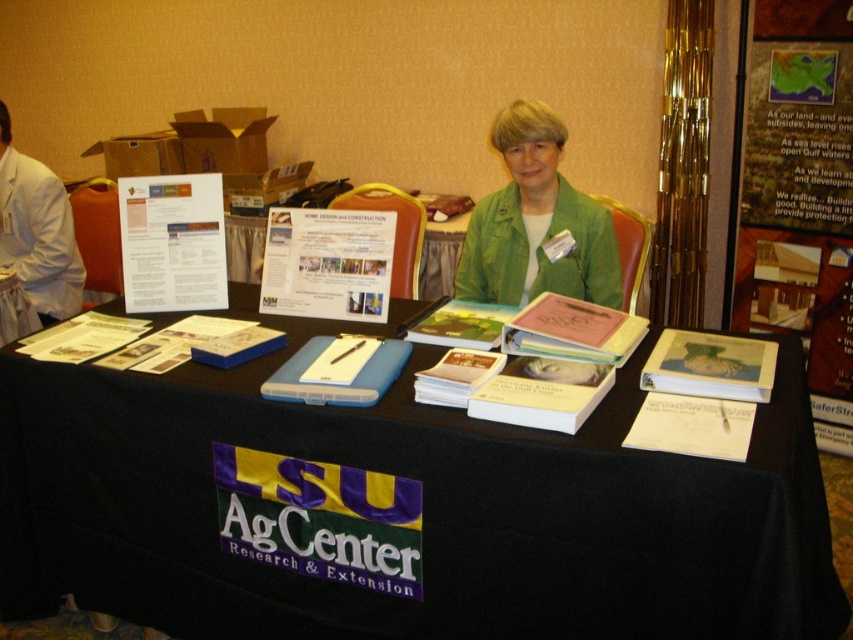
Question: Does green fabric jacket at center appear on the left side of white lab coat at left?

Choices:
 (A) yes
 (B) no

Answer: (B)

Question: Which point is closer to the camera?

Choices:
 (A) white paper at center
 (B) hardcover book at center
 (C) green fabric jacket at center

Answer: (B)

Question: Is black fabric table at center to the left of matte green book at center from the viewer's perspective?

Choices:
 (A) yes
 (B) no

Answer: (A)

Question: Which point appears closest to the camera in this image?

Choices:
 (A) (26, 353)
 (B) (326, 584)
 (C) (833, 49)

Answer: (B)

Question: Which point is farther to the camera?

Choices:
 (A) (32, 289)
 (B) (489, 371)
 (C) (596, 300)

Answer: (A)

Question: Is matte paper poster at upper center positioned in front of blue plastic folder at center?

Choices:
 (A) no
 (B) yes

Answer: (A)